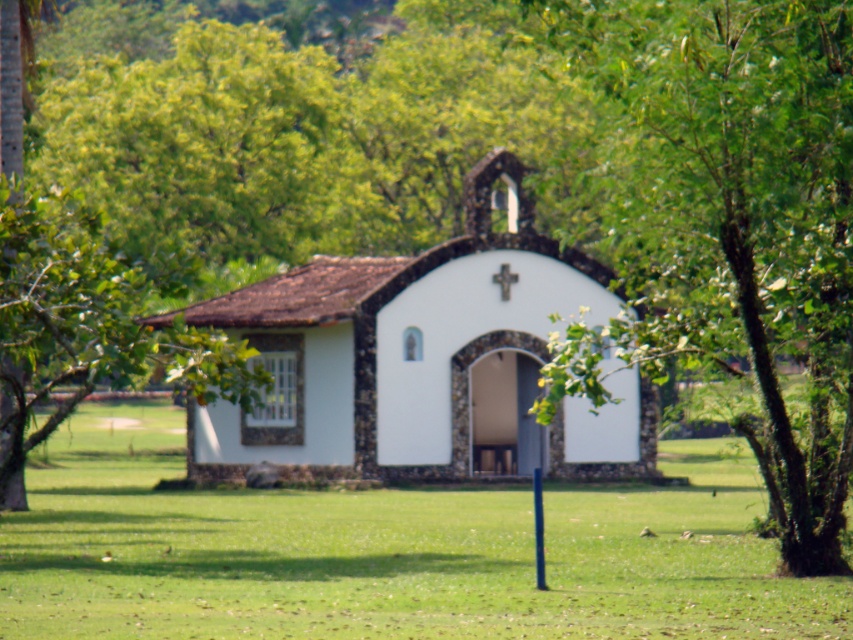
Question: Among these objects, which one is nearest to the camera?

Choices:
 (A) green grass at center
 (B) white stucco church at center

Answer: (A)

Question: Which point is farther to the camera?

Choices:
 (A) (286, 524)
 (B) (492, 406)

Answer: (B)

Question: Is green grass at center below white stucco church at center?

Choices:
 (A) no
 (B) yes

Answer: (B)

Question: Does green grass at center come behind white stucco church at center?

Choices:
 (A) yes
 (B) no

Answer: (B)

Question: Is green grass at center below white stucco church at center?

Choices:
 (A) no
 (B) yes

Answer: (B)